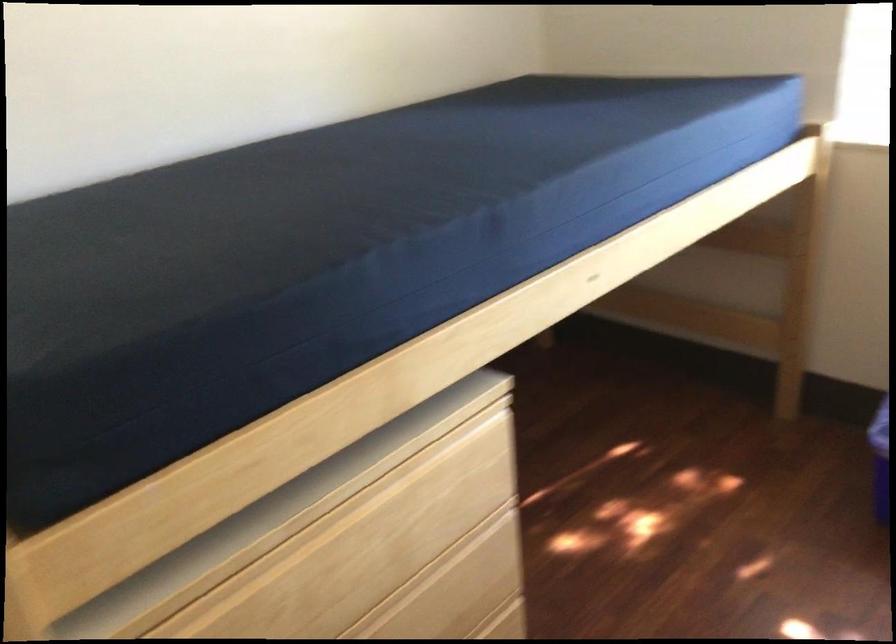
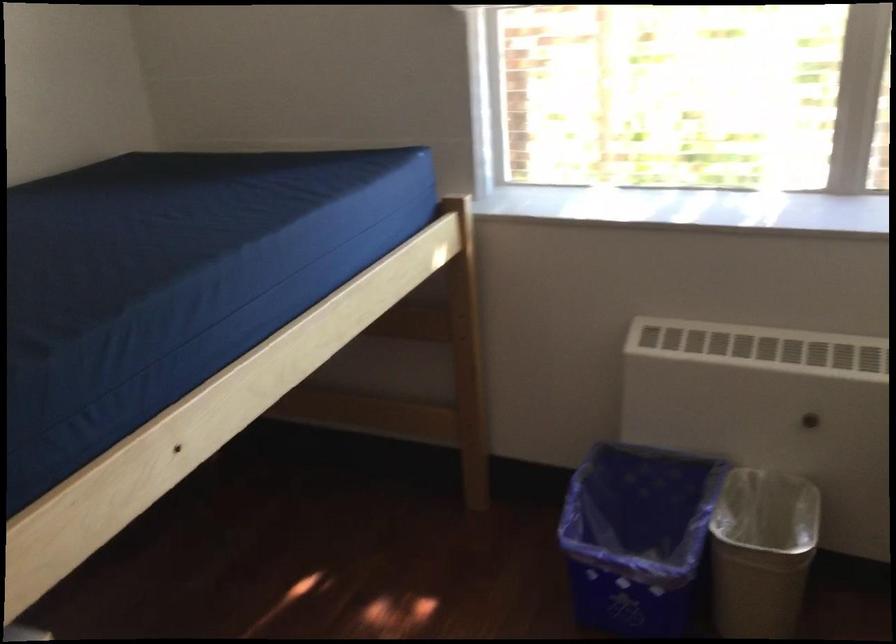
In a continuous first-person perspective shot, in which direction is the camera moving?

The cameraman moved toward right, forward.